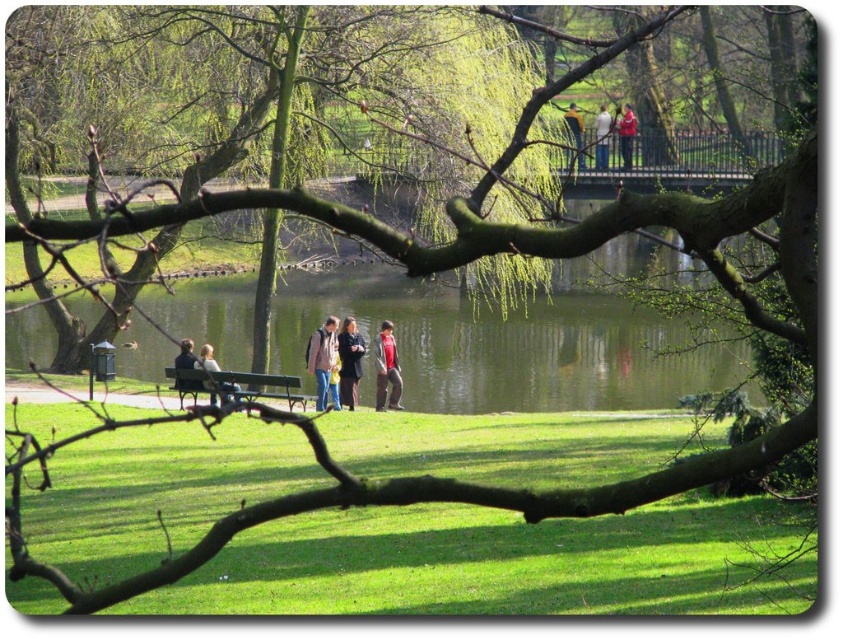
Question: Is wooden bench at center thinner than dark blue jacket at lower left?

Choices:
 (A) no
 (B) yes

Answer: (A)

Question: Which is nearer to the light brown leather jacket at upper center?

Choices:
 (A) red fabric jacket at center
 (B) dark gray coat at center
 (C) red fabric jacket at upper center

Answer: (C)

Question: Is green water at center wider than golden textured hair at upper center?

Choices:
 (A) yes
 (B) no

Answer: (A)

Question: Which is nearer to the light brown leather jacket at upper center?

Choices:
 (A) dark gray coat at center
 (B) green water at center

Answer: (B)

Question: Considering the real-world distances, which object is farthest from the light brown leather jacket at upper center?

Choices:
 (A) wooden bench at center
 (B) light brown leather jacket at center
 (C) red fabric jacket at upper center

Answer: (A)

Question: Is light brown leather jacket at center smaller than light brown leather jacket at upper center?

Choices:
 (A) yes
 (B) no

Answer: (B)